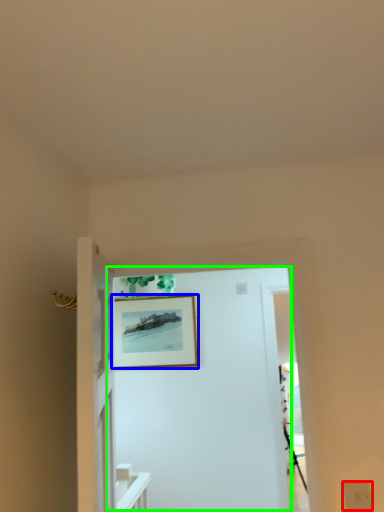
Question: Considering the real-world distances, which object is farthest from electric outlet (highlighted by a red box)? picture frame (highlighted by a blue box) or door (highlighted by a green box)?

Choices:
 (A) picture frame
 (B) door

Answer: (A)